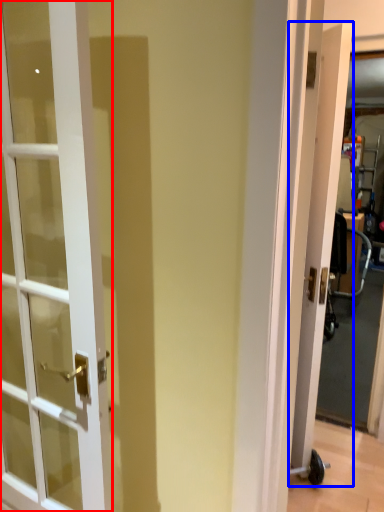
Question: Among these objects, which one is nearest to the camera, door (highlighted by a red box) or door (highlighted by a blue box)?

Choices:
 (A) door
 (B) door

Answer: (A)